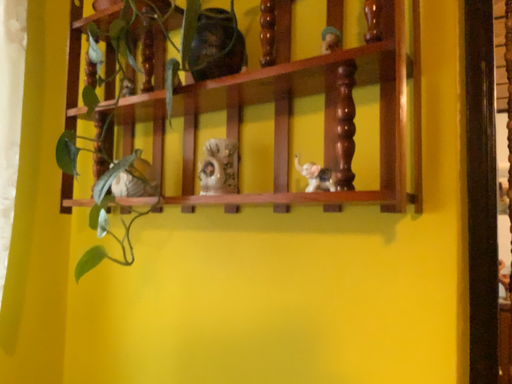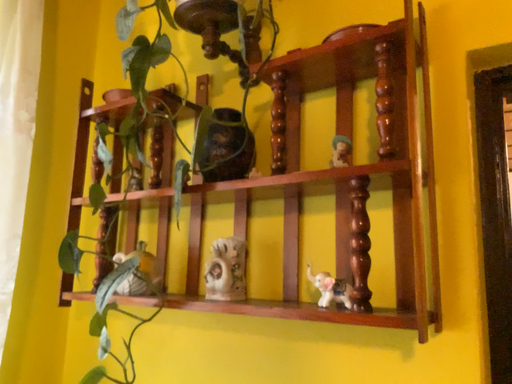
Question: Which way did the camera rotate in the video?

Choices:
 (A) rotated downward
 (B) rotated upward

Answer: (B)